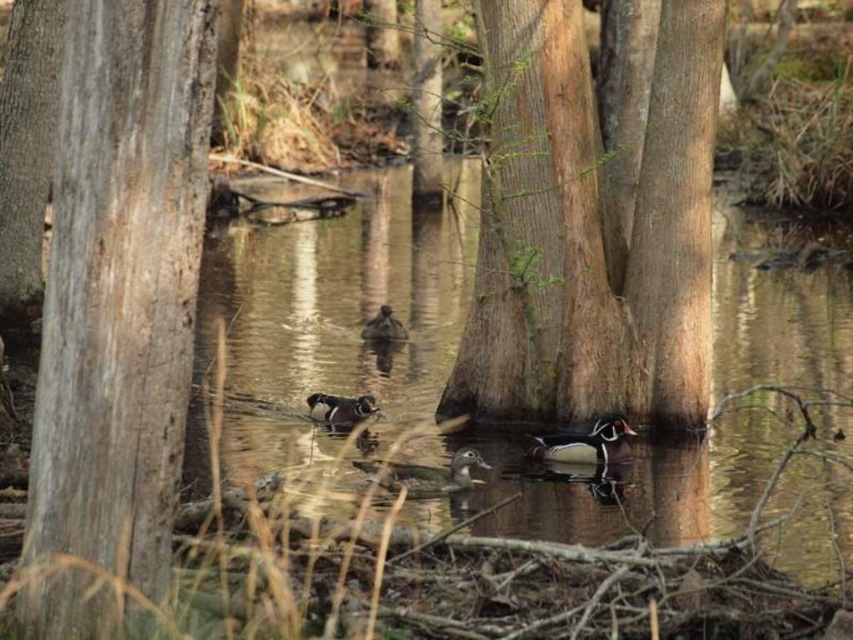
You are a photographer trying to capture the reflection of the translucent water at center in your shot. Since the brown speckled duck at center is blocking the view, can you estimate whether the duck is above or below the water level to adjust your camera angle accordingly?

The translucent water at center is taller than brown speckled duck at center, meaning the duck is partially submerged but its head is above the water level. To capture the reflection, position the camera slightly below the duck to include both the duck and its reflection in the water.

You are a photographer trying to capture both the shiny brown duck at center and the multicolored glossy wood duck at center in a single shot. Which duck should you adjust your camera to focus on first if you want to ensure both are in the frame?

The shiny brown duck at center is positioned on the right side of multicolored glossy wood duck at center, so you should focus on the multicolored glossy wood duck at center first to ensure both are within the frame.

You are a birdwatcher observing the ducks in the serene wooded area. You notice two ducks at the center of the water. Which duck is taller between the shiny brown duck at center and the multicolored glossy wood duck at center?

The shiny brown duck at center is taller than the multicolored glossy wood duck at center.